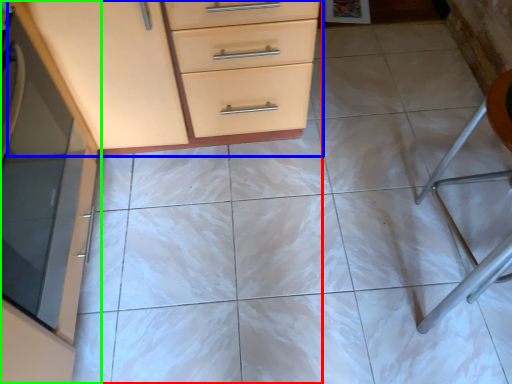
Question: Considering the real-world distances, which object is farthest from chest of drawers (highlighted by a red box)? chest of drawers (highlighted by a blue box) or cabinetry (highlighted by a green box)?

Choices:
 (A) chest of drawers
 (B) cabinetry

Answer: (B)